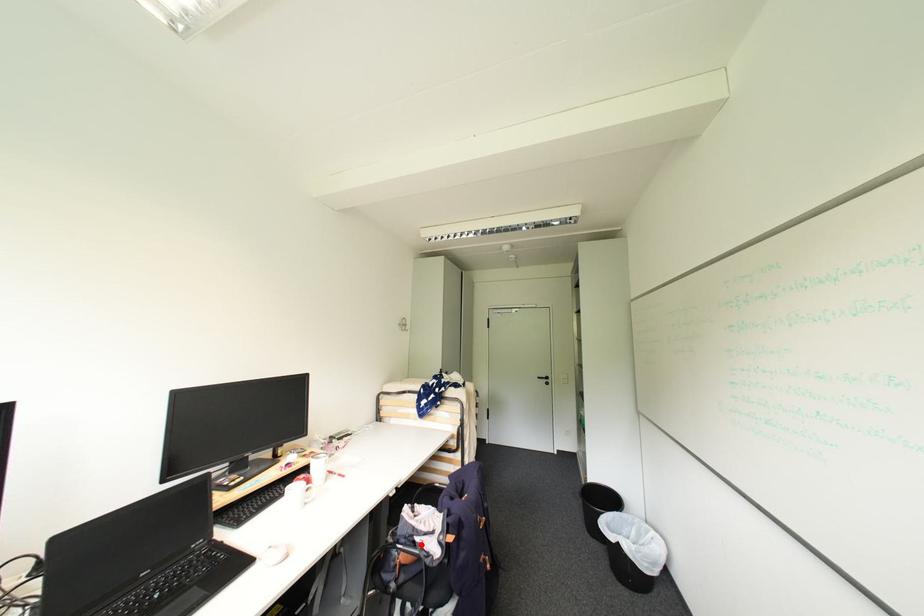
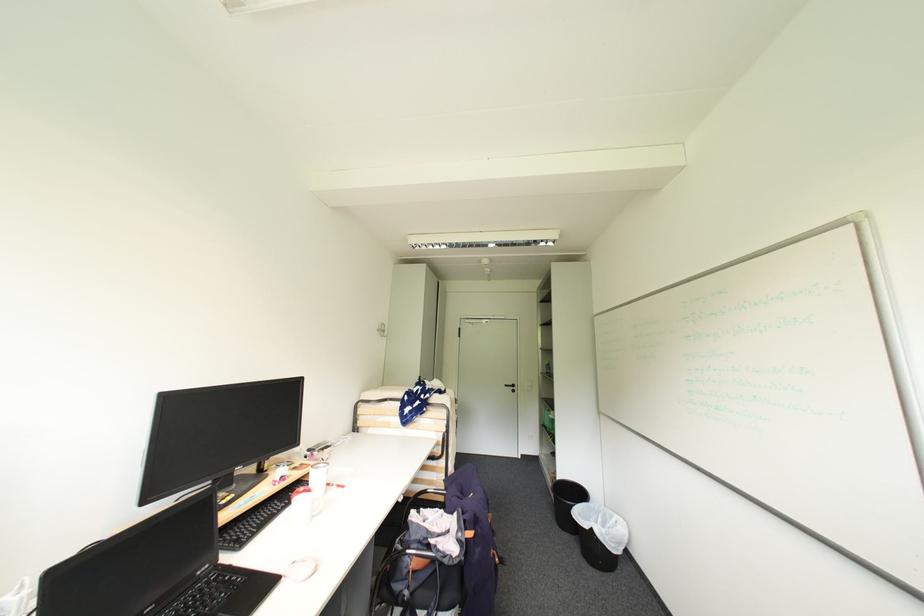
Question: I am providing you with two images of the same scene from different viewpoints. A red point is marked on the first image. At the location where the point appears in image 1, is it still visible in image 2?

Choices:
 (A) Yes
 (B) No

Answer: (A)